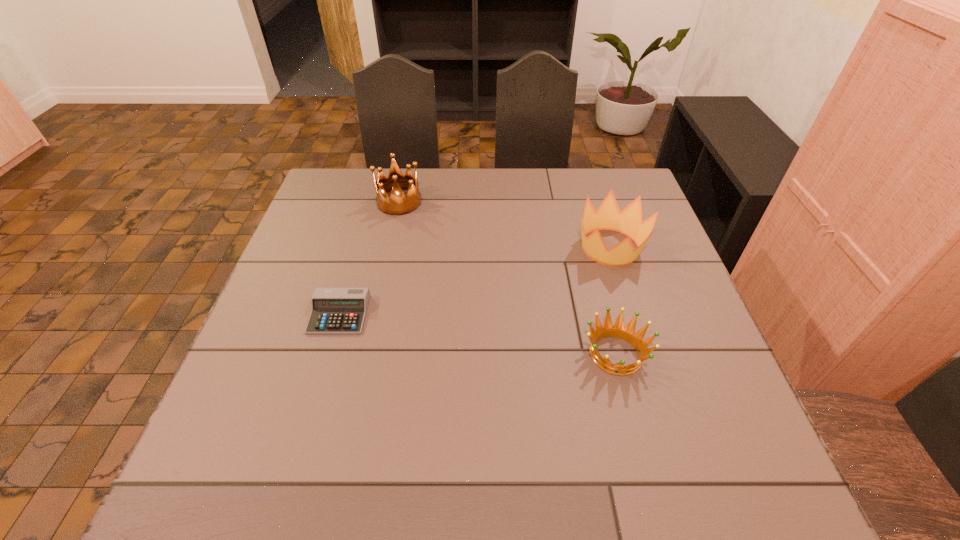
Locate an element on the screen. the farthest object is located at coordinates (398, 204).

You are a GUI agent. You are given a task and a screenshot of the screen. Output one action in this format:
    pyautogui.click(x=<x>, y=<y>)
    Task: Click on the farthest crown
    
    Given the screenshot: What is the action you would take?
    click(x=398, y=204)

Locate an element on the screen. the third nearest object is located at coordinates (608, 216).

Locate an element on the screen. the nearest crown is located at coordinates (617, 330).

This screenshot has width=960, height=540. What are the coordinates of `the shortest crown` in the screenshot? It's located at (617, 330).

Identify the location of calculator. (333, 310).

Identify the location of free space located 0.360m on the front of the farthest crown. (375, 308).

At what (x,y) coordinates should I click in order to perform the action: click on free location located 0.390m on the front of the second farthest object. Please return your answer as a coordinate pair (x, y). Looking at the image, I should click on tap(662, 414).

The image size is (960, 540). I want to click on vacant space located 0.170m on the front of the second shortest object, so pos(645,468).

Where is `free space located on the back of the shortest object`? free space located on the back of the shortest object is located at coordinates (361, 242).